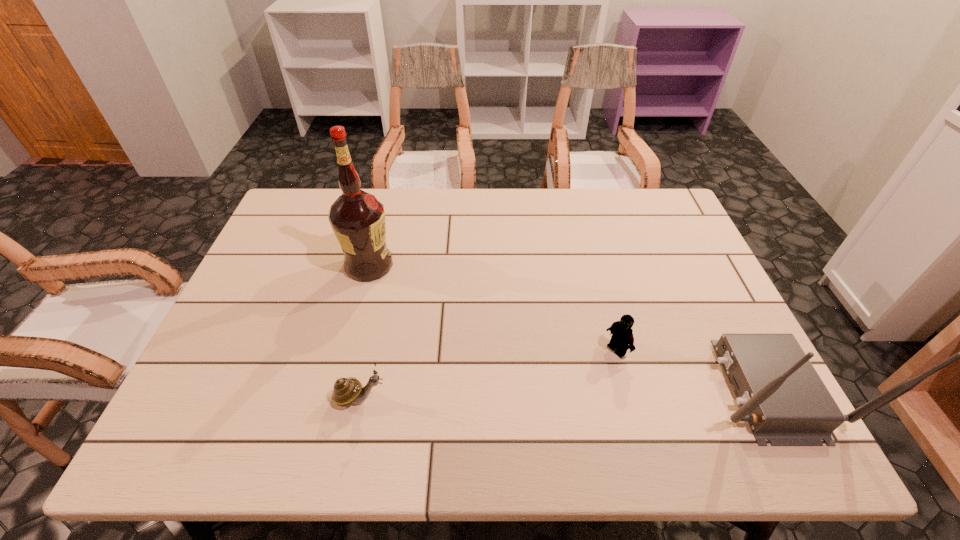
What are the coordinates of `snail` in the screenshot? It's located at (349, 390).

The image size is (960, 540). I want to click on the rightmost object, so 784,400.

Image resolution: width=960 pixels, height=540 pixels. I want to click on the third shortest object, so click(x=784, y=400).

Identify the location of Lego. (622, 334).

Find the location of `the tallest object`. the tallest object is located at coordinates (357, 218).

Image resolution: width=960 pixels, height=540 pixels. Identify the location of alcohol. (357, 218).

Image resolution: width=960 pixels, height=540 pixels. What are the coordinates of `free space located 0.200m on the face of the snail` in the screenshot? It's located at (478, 397).

In order to click on blank space located 0.160m on the back of the third shortest object to connect cables in this screenshot , I will do `click(638, 388)`.

This screenshot has height=540, width=960. Identify the location of free space located on the back of the third shortest object to connect cables. (548, 388).

The width and height of the screenshot is (960, 540). What are the coordinates of `vacant region located 0.400m on the back of the third shortest object to connect cables` in the screenshot? It's located at (531, 388).